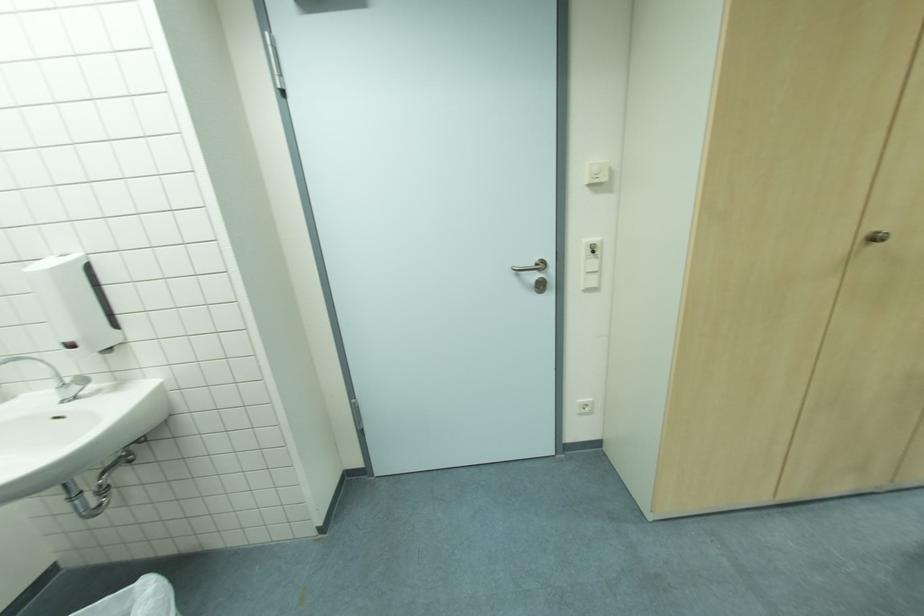
The height and width of the screenshot is (616, 924). What do you see at coordinates (73, 387) in the screenshot?
I see `the faucet handle` at bounding box center [73, 387].